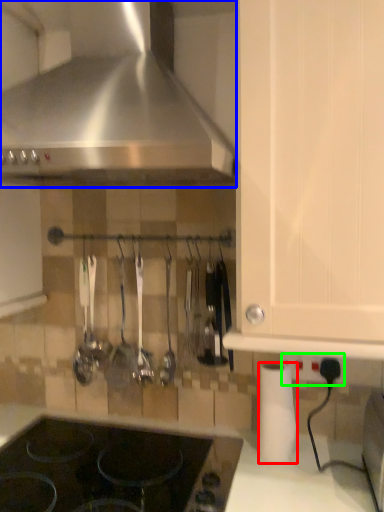
Question: Considering the real-world distances, which object is farthest from paper towel (highlighted by a red box)? kitchen appliance (highlighted by a blue box) or electric outlet (highlighted by a green box)?

Choices:
 (A) kitchen appliance
 (B) electric outlet

Answer: (A)